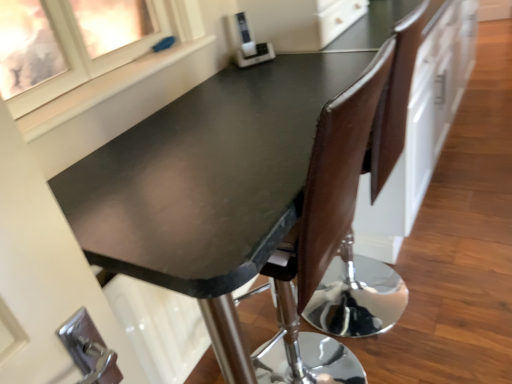
Find the location of a particular element. vacant area that lies to the right of brown leather chair at center is located at coordinates (450, 276).